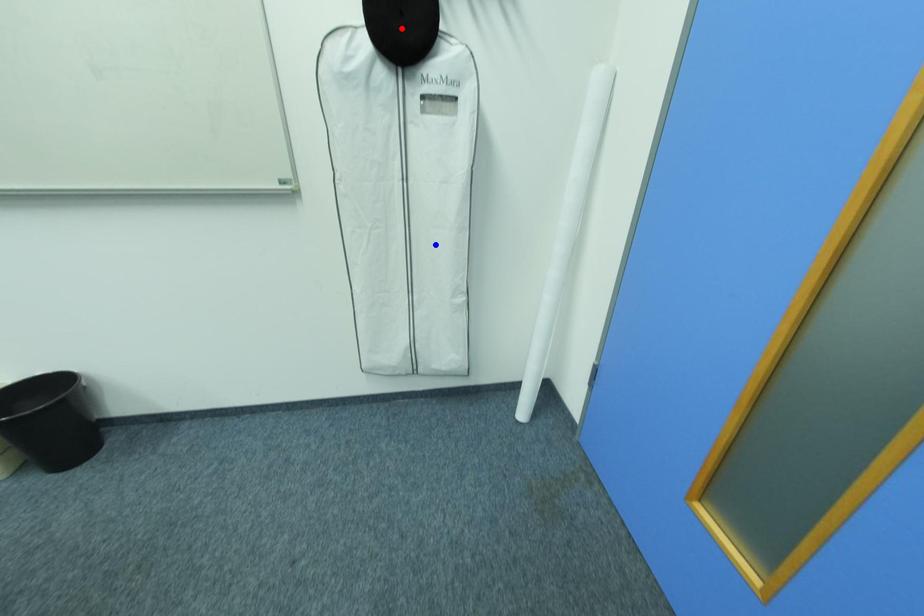
Question: In the image, two points are highlighted. Which point is nearer to the camera? Reply with the corresponding letter.

Choices:
 (A) blue point
 (B) red point

Answer: (B)